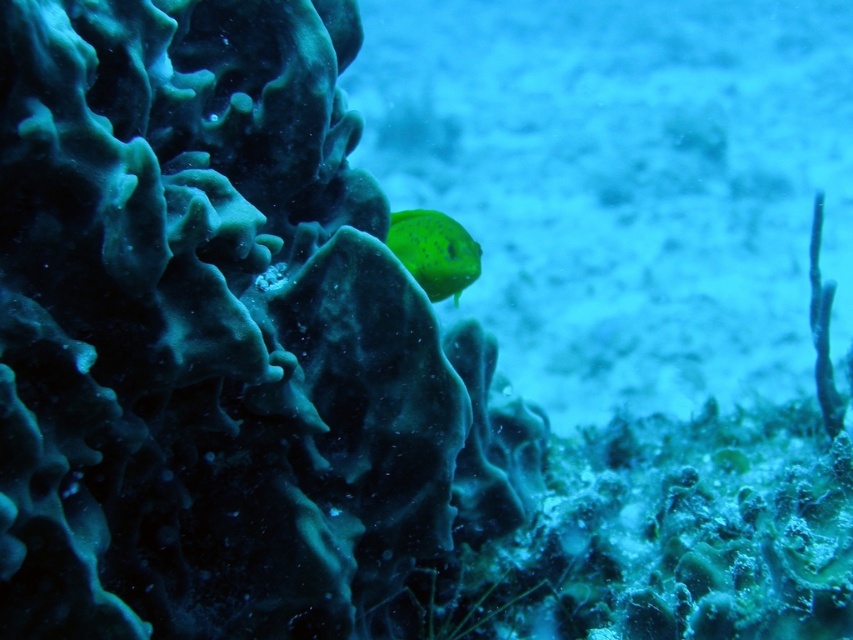
Is point (440, 76) closer to camera compared to point (387, 230)?

No, it is not.

Who is more distant from viewer, (416, 93) or (456, 240)?

Point (416, 93)

Find the location of a particular element. This screenshot has height=640, width=853. translucent green water at center is located at coordinates click(625, 186).